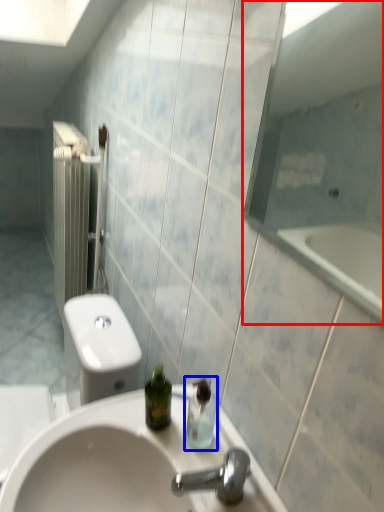
Question: Which of the following is the farthest to the observer, mirror (highlighted by a red box) or soap dispenser (highlighted by a blue box)?

Choices:
 (A) mirror
 (B) soap dispenser

Answer: (B)